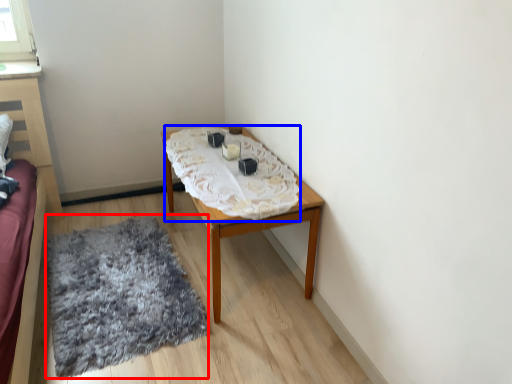
Question: Which point is closer to the camera, mat (highlighted by a red box) or blanket (highlighted by a blue box)?

Choices:
 (A) mat
 (B) blanket

Answer: (A)